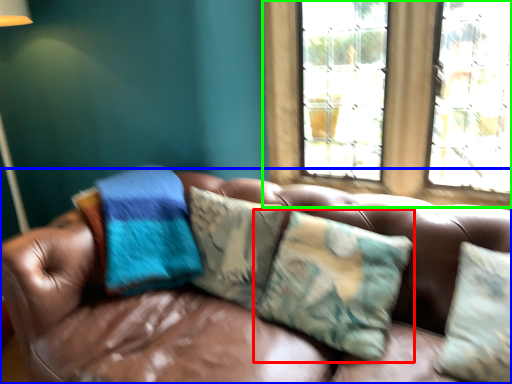
Question: Which is farther away from pillow (highlighted by a red box)? studio couch (highlighted by a blue box) or window (highlighted by a green box)?

Choices:
 (A) studio couch
 (B) window

Answer: (B)